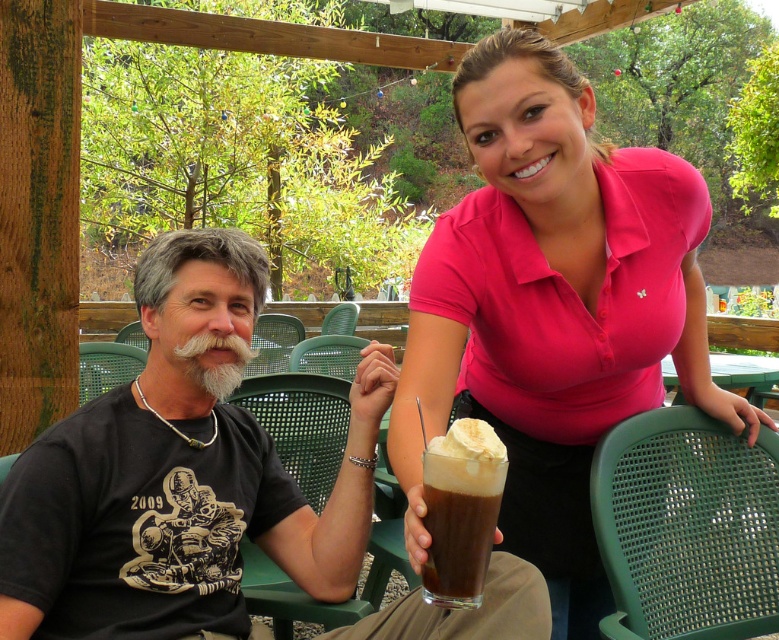
Who is shorter, black matte t-shirt at left or chocolate frosted glass at center?

chocolate frosted glass at center

Measure the distance between black matte t-shirt at left and chocolate frosted glass at center.

black matte t-shirt at left and chocolate frosted glass at center are 16.06 inches apart.

What do you see at coordinates (178, 474) in the screenshot? I see `black matte t-shirt at left` at bounding box center [178, 474].

Where is `black matte t-shirt at left`? The image size is (779, 640). black matte t-shirt at left is located at coordinates (178, 474).

Image resolution: width=779 pixels, height=640 pixels. What do you see at coordinates (552, 308) in the screenshot?
I see `pink cotton shirt at upper right` at bounding box center [552, 308].

Is pink cotton shirt at upper right positioned behind black matte t-shirt at left?

No.

Image resolution: width=779 pixels, height=640 pixels. What are the coordinates of `pink cotton shirt at upper right` in the screenshot? It's located at point(552,308).

Who is more forward, (591, 316) or (474, 532)?

Point (474, 532) is more forward.

Between pink cotton shirt at upper right and chocolate frosted glass at center, which one has less height?

With less height is chocolate frosted glass at center.

The height and width of the screenshot is (640, 779). Find the location of `pink cotton shirt at upper right`. pink cotton shirt at upper right is located at coordinates (552, 308).